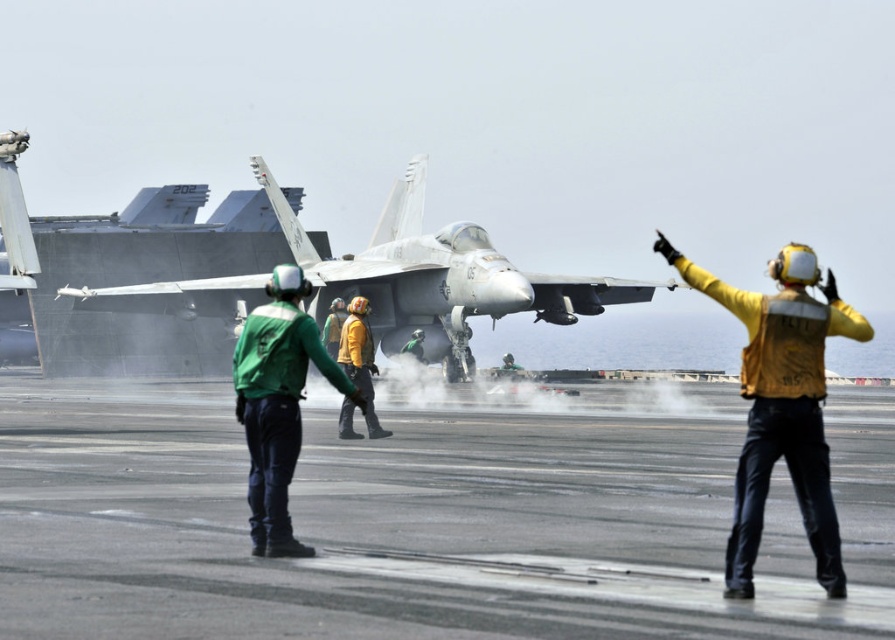
Which is below, yellow matte jacket at upper right or yellow fabric helmet at center?

Positioned lower is yellow fabric helmet at center.

The image size is (895, 640). What do you see at coordinates (781, 404) in the screenshot?
I see `yellow matte jacket at upper right` at bounding box center [781, 404].

In order to click on yellow matte jacket at upper right in this screenshot , I will do `click(781, 404)`.

Is white matte fighter jet at center bigger than yellow fabric helmet at center?

Yes, white matte fighter jet at center is bigger than yellow fabric helmet at center.

Is point (244, 291) less distant than point (358, 436)?

No.

Is point (476, 259) positioned before point (360, 380)?

No, it is behind (360, 380).

Locate an element on the screen. white matte fighter jet at center is located at coordinates coord(440,273).

Can you confirm if green fabric uniform at center is bigger than yellow fabric helmet at center?

No, green fabric uniform at center is not bigger than yellow fabric helmet at center.

You are a GUI agent. You are given a task and a screenshot of the screen. Output one action in this format:
    pyautogui.click(x=<x>, y=<y>)
    Task: Click on the green fabric uniform at center
    This screenshot has width=895, height=640.
    Given the screenshot: What is the action you would take?
    pyautogui.click(x=278, y=403)

Who is more forward, (254,480) or (341,412)?

Positioned in front is point (254,480).

The width and height of the screenshot is (895, 640). I want to click on green fabric uniform at center, so click(278, 403).